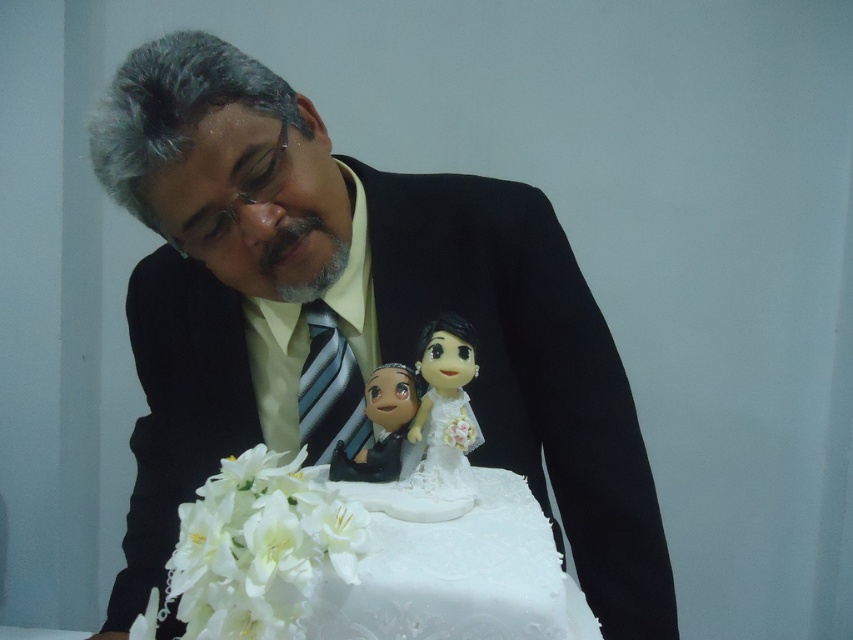
You are a professional cake decorator who needs to ensure the stability of the cake. The porcelain doll at center and the matte plastic figurine at center are placed on the cake. Which object should you avoid placing on the top tier to prevent it from toppling over?

The porcelain doll at center is much taller than the matte plastic figurine at center, so placing the taller porcelain doll at center on the top tier increases the risk of the cake toppling over. Therefore, you should avoid placing the porcelain doll at center on the top tier.

You are a photographer taking a picture of the white glossy wedding cake at center. You need to position your camera at point (373, 536). Where exactly should you aim your camera?

You should aim your camera at the white glossy wedding cake at center, as point (373, 536) marks its location.